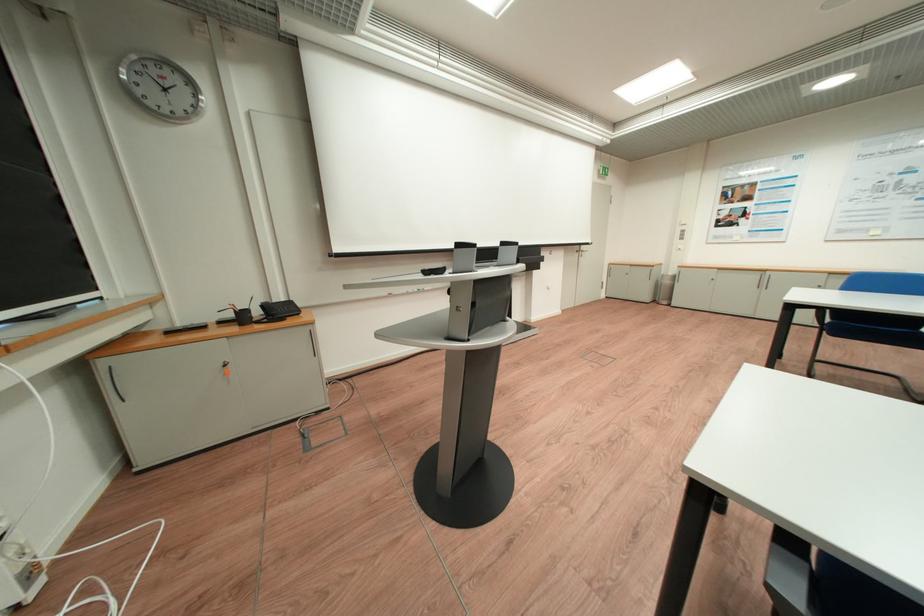
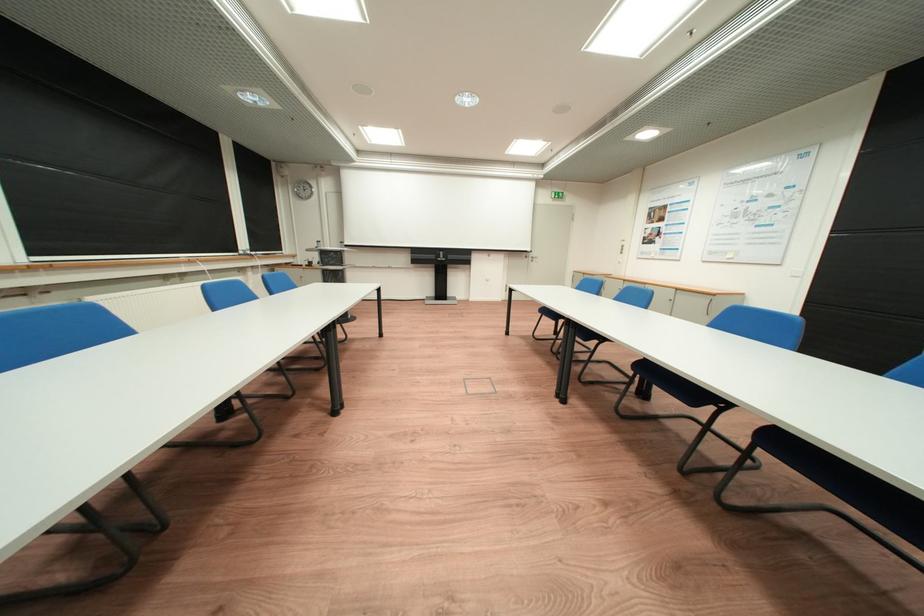
Question: I am providing you with two images of the same scene from different viewpoints. Please identify which objects are invisible in image2.

Choices:
 (A) red leather case
 (B) projector screen handle
 (C) door handle
 (D) metal trash can

Answer: (D)